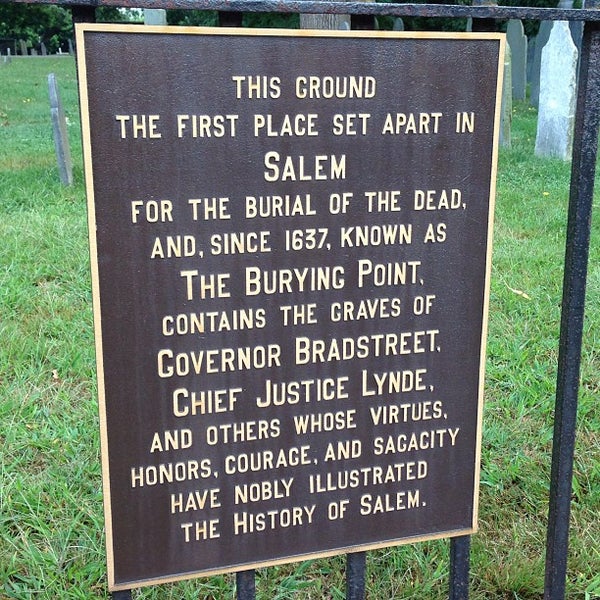
I want to click on plaque, so click(x=449, y=292).